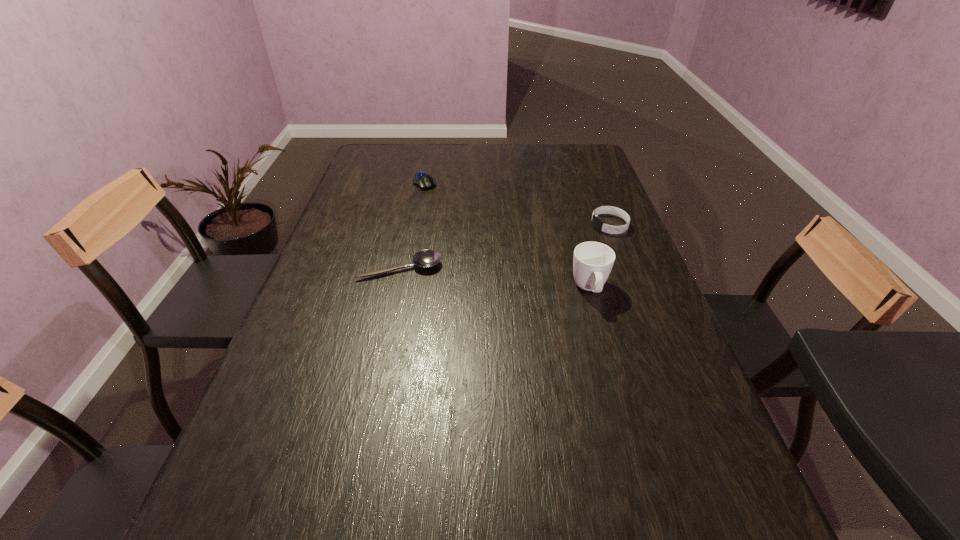
At what (x,y) coordinates should I click in order to perform the action: click on the shortest object. Please return your answer as a coordinate pair (x, y). Looking at the image, I should click on (425, 258).

Locate an element on the screen. cup is located at coordinates (592, 263).

The height and width of the screenshot is (540, 960). I want to click on the second object from right to left, so click(x=592, y=263).

Identify the location of the farthest object. The width and height of the screenshot is (960, 540). (422, 179).

At what (x,y) coordinates should I click in order to perform the action: click on computer mouse. Please return your answer as a coordinate pair (x, y). This screenshot has height=540, width=960. Looking at the image, I should click on (422, 179).

You are a GUI agent. You are given a task and a screenshot of the screen. Output one action in this format:
    pyautogui.click(x=<x>, y=<y>)
    Task: Click on the rightmost object
    
    Given the screenshot: What is the action you would take?
    pyautogui.click(x=597, y=223)

Image resolution: width=960 pixels, height=540 pixels. Identify the location of the third shortest object. (597, 223).

Locate an element on the screen. vacant region located on the back of the ladle is located at coordinates (408, 231).

Identify the location of free region located with the handle on the side of the third object from left to right. (618, 392).

Locate an element on the screen. free space located on the button side of the third tallest object is located at coordinates (465, 246).